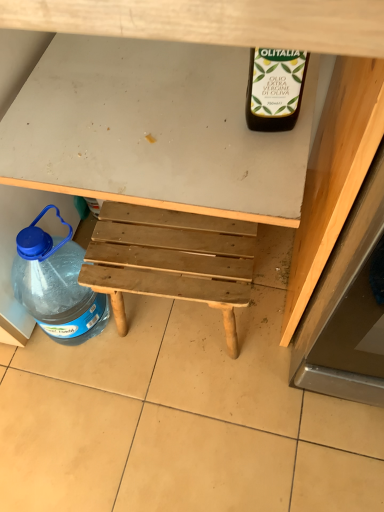
What do you see at coordinates (56, 285) in the screenshot?
I see `transparent plastic bottle at lower left` at bounding box center [56, 285].

Where is `transparent plastic bottle at lower left`? transparent plastic bottle at lower left is located at coordinates (56, 285).

Identify the location of stool that appears behind the wooden bench at center. The image size is (384, 512). (171, 260).

Is natural wood stool at center not near wooden bench at center?

That's not correct — natural wood stool at center is a little close to wooden bench at center.

Considering the relative sizes of natural wood stool at center and wooden bench at center in the image provided, is natural wood stool at center thinner than wooden bench at center?

Yes.

From the image's perspective, who appears lower, transparent plastic bottle at lower left or natural wood stool at center?

transparent plastic bottle at lower left, from the image's perspective.

Which is more to the right, transparent plastic bottle at lower left or natural wood stool at center?

natural wood stool at center is more to the right.

Which of these two, transparent plastic bottle at lower left or natural wood stool at center, is wider?

With larger width is transparent plastic bottle at lower left.

Based on the photo, does transparent plastic bottle at lower left touch natural wood stool at center?

No.

Consider the image. From a real-world perspective, between wooden bench at center and transparent plastic bottle at lower left, who is vertically higher?

wooden bench at center, from a real-world perspective.

Find the location of a particular element. The image size is (384, 512). desk in front of the transparent plastic bottle at lower left is located at coordinates (270, 46).

Is point (324, 114) closer or farther from the camera than point (53, 247)?

Point (324, 114) appears to be farther away from the viewer than point (53, 247).

Is wooden bench at center smaller than natural wood stool at center?

Actually, wooden bench at center might be larger than natural wood stool at center.

In terms of width, does wooden bench at center look wider or thinner when compared to natural wood stool at center?

wooden bench at center is wider than natural wood stool at center.

From a real-world perspective, is wooden bench at center located higher than natural wood stool at center?

Correct, in the physical world, wooden bench at center is higher than natural wood stool at center.

From the image's perspective, who appears lower, natural wood stool at center or transparent plastic bottle at lower left?

From the image's view, transparent plastic bottle at lower left is below.

Is natural wood stool at center positioned beyond the bounds of transparent plastic bottle at lower left?

natural wood stool at center is positioned outside transparent plastic bottle at lower left.

Which is in front, natural wood stool at center or transparent plastic bottle at lower left?

transparent plastic bottle at lower left is in front.

Is natural wood stool at center facing towards transparent plastic bottle at lower left?

No, natural wood stool at center is not oriented towards transparent plastic bottle at lower left.

Could you tell me if transparent plastic bottle at lower left is facing wooden bench at center?

Yes, transparent plastic bottle at lower left is oriented towards wooden bench at center.

From a real-world perspective, is transparent plastic bottle at lower left positioned over wooden bench at center based on gravity?

No, from a real-world perspective, transparent plastic bottle at lower left is not above wooden bench at center.

Considering the sizes of transparent plastic bottle at lower left and wooden bench at center in the image, is transparent plastic bottle at lower left taller or shorter than wooden bench at center?

In the image, transparent plastic bottle at lower left appears to be shorter than wooden bench at center.

Is transparent plastic bottle at lower left next to wooden bench at center?

transparent plastic bottle at lower left and wooden bench at center are not in contact.

Locate an element on the screen. stool on the right side of wooden bench at center is located at coordinates (171, 260).

Find the location of `stool behind the transparent plastic bottle at lower left`. stool behind the transparent plastic bottle at lower left is located at coordinates (171, 260).

Based on their spatial positions, is natural wood stool at center or wooden bench at center further from transparent plastic bottle at lower left?

Among the two, wooden bench at center is located further to transparent plastic bottle at lower left.

When comparing their distances from wooden bench at center, does transparent plastic bottle at lower left or natural wood stool at center seem further?

The object further to wooden bench at center is transparent plastic bottle at lower left.

From the image, which object appears to be farther from natural wood stool at center, transparent plastic bottle at lower left or wooden bench at center?

wooden bench at center is further to natural wood stool at center.

Looking at the image, which one is located further to transparent plastic bottle at lower left, wooden bench at center or natural wood stool at center?

wooden bench at center lies further to transparent plastic bottle at lower left than the other object.

Consider the image. Looking at the image, which one is located closer to natural wood stool at center, wooden bench at center or transparent plastic bottle at lower left?

transparent plastic bottle at lower left is closer to natural wood stool at center.

Which object lies further to the anchor point wooden bench at center, natural wood stool at center or transparent plastic bottle at lower left?

transparent plastic bottle at lower left is further to wooden bench at center.

This screenshot has width=384, height=512. What are the coordinates of `bottle positioned between wooden bench at center and natural wood stool at center from near to far` in the screenshot? It's located at (56, 285).